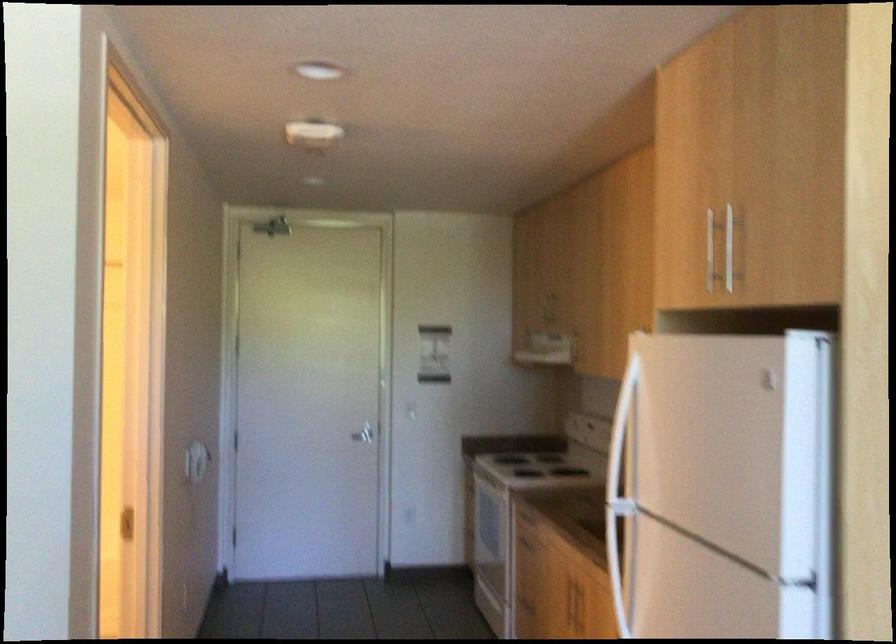
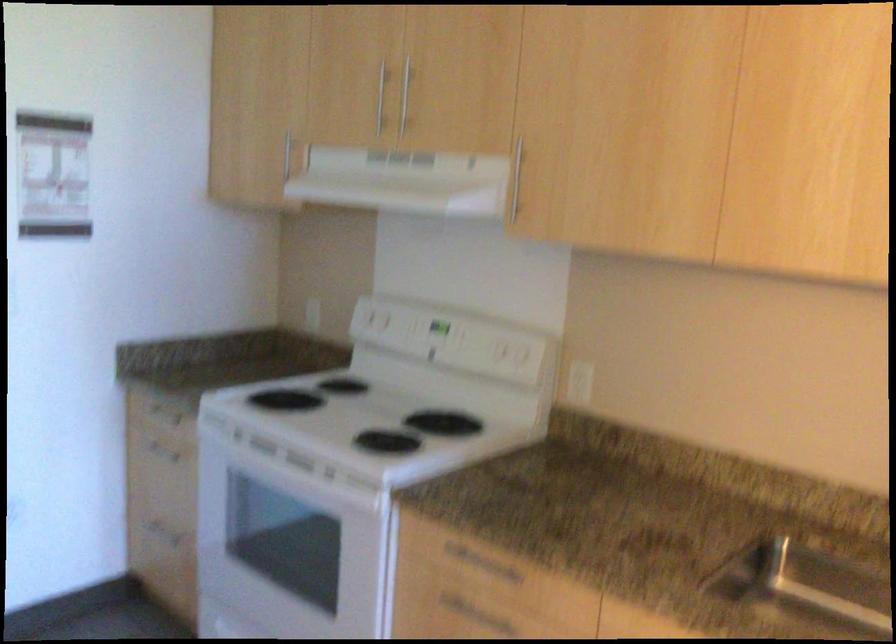
Find the pixel in the second image that matches the point at 537,527 in the first image.

(466, 609)